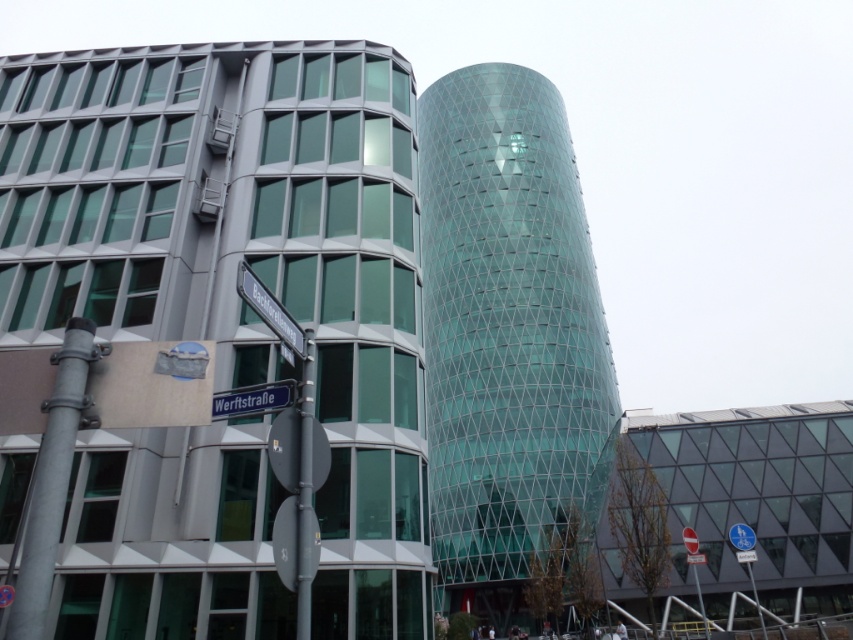
Looking at this image, you are a delivery drone flying over the urban area shown. You need to deliver a package to the blue metallic street sign at lower center. The metallic pole at center is blocking your path. Can you fly around it to reach the sign?

The blue metallic street sign at lower center is behind the metallic pole at center, so you can fly around the pole to reach the sign.

You are a city planner analyzing the street signs in the image. Which of the two street signs, the black plastic street sign at upper center or the blue metallic street sign at lower center, has a smaller width?

The black plastic street sign at upper center is thinner than the blue metallic street sign at lower center, so it has a smaller width.

You are a delivery drone with a wingspan of 28 inches. You need to fly between the metallic pole at center and the black plastic street sign at upper center. Can you safely pass through the space between them without touching either object?

The distance between the metallic pole at center and the black plastic street sign at upper center is 32.74 inches. Since your wingspan is 28 inches, you can safely pass through the space between them as the distance is greater than your wingspan.